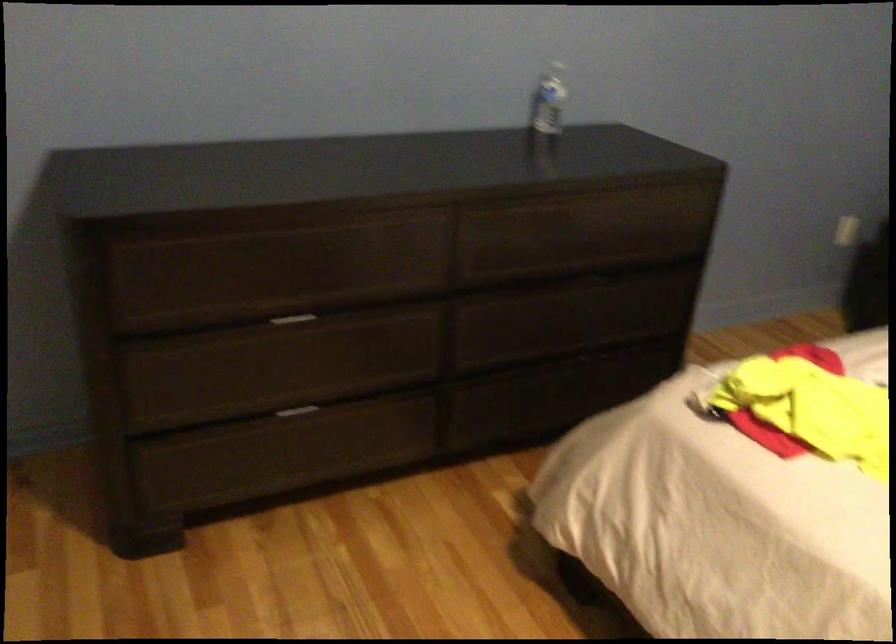
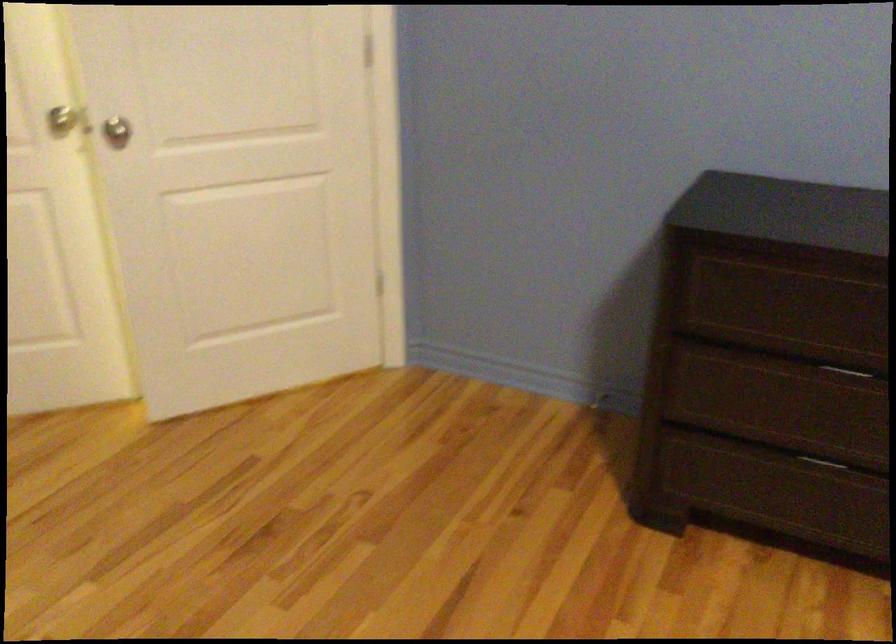
Question: The images are taken continuously from a first-person perspective. In which direction is your viewpoint rotating?

Choices:
 (A) Left
 (B) Right
 (C) Up
 (D) Down

Answer: (A)